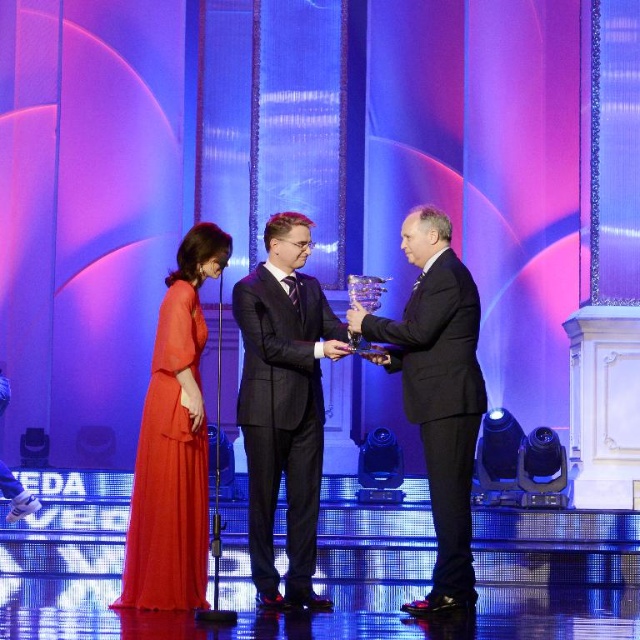
You are a photographer at the award ceremony. You need to capture a photo where the black glossy suit at center and the matte orange dress at center are both visible. Based on their positions, which one will appear higher in the photo?

The black glossy suit at center is located above the matte orange dress at center, so it will appear higher in the photo.

You are a photographer at the ceremony and want to capture a photo where the matte orange dress at center is on the left side of the dark gray suit at center. Based on the current arrangement, is this already the case?

Yes, the dark gray suit at center is positioned on the right side of matte orange dress at center, so the matte orange dress at center is already on the left side of the dark gray suit at center.

You are attending the award ceremony and need to find the person wearing the dark gray suit at center and the matte orange dress at center. Which one is taller?

A: The dark gray suit at center is much taller than the matte orange dress at center.